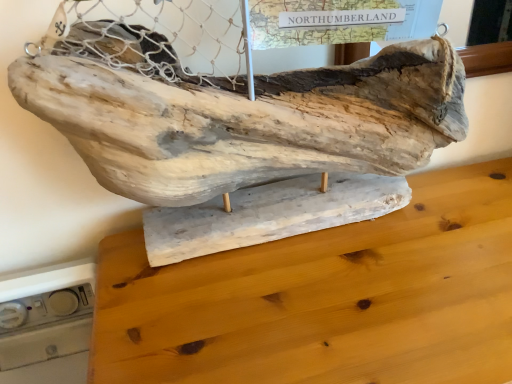
Identify the location of natural wood sculpture at center. (248, 120).

The height and width of the screenshot is (384, 512). What do you see at coordinates (248, 120) in the screenshot?
I see `natural wood sculpture at center` at bounding box center [248, 120].

What do you see at coordinates (325, 298) in the screenshot?
I see `natural wood table at center` at bounding box center [325, 298].

I want to click on natural wood table at center, so click(x=325, y=298).

From the picture: What is the approximate width of natural wood table at center?

16.70 inches.

Identify the location of natural wood sculpture at center. Image resolution: width=512 pixels, height=384 pixels. (248, 120).

Considering the positions of objects natural wood table at center and natural wood sculpture at center in the image provided, who is more to the left, natural wood table at center or natural wood sculpture at center?

Positioned to the left is natural wood sculpture at center.

Who is more distant, natural wood table at center or natural wood sculpture at center?

natural wood sculpture at center.

Between point (270, 350) and point (92, 121), which one is positioned in front?

The point (92, 121) is more forward.

From the image's perspective, is natural wood table at center on natural wood sculpture at center?

No.

From a real-world perspective, is natural wood table at center positioned over natural wood sculpture at center based on gravity?

No, from a real-world perspective, natural wood table at center is not above natural wood sculpture at center.

Between natural wood table at center and natural wood sculpture at center, which one has smaller width?

With smaller width is natural wood sculpture at center.

Is natural wood table at center taller or shorter than natural wood sculpture at center?

In the image, natural wood table at center appears to be taller than natural wood sculpture at center.

Who is bigger, natural wood table at center or natural wood sculpture at center?

natural wood table at center.

From the picture: Is natural wood table at center inside the boundaries of natural wood sculpture at center, or outside?

natural wood table at center is not inside natural wood sculpture at center, it's outside.

Is natural wood table at center touching natural wood sculpture at center?

natural wood table at center is not next to natural wood sculpture at center, and they're not touching.

Is natural wood table at center looking in the opposite direction of natural wood sculpture at center?

That's not correct — natural wood table at center is not looking away from natural wood sculpture at center.

How distant is natural wood table at center from natural wood sculpture at center?

A distance of 6.93 inches exists between natural wood table at center and natural wood sculpture at center.

You are a GUI agent. You are given a task and a screenshot of the screen. Output one action in this format:
    pyautogui.click(x=<x>, y=<y>)
    Task: Click on the furniture below the natural wood sculpture at center (from a real-world perspective)
    Image resolution: width=512 pixels, height=384 pixels.
    Given the screenshot: What is the action you would take?
    pyautogui.click(x=325, y=298)

Considering the relative positions of natural wood sculpture at center and natural wood table at center in the image provided, is natural wood sculpture at center to the left or to the right of natural wood table at center?

Clearly, natural wood sculpture at center is on the left of natural wood table at center in the image.

Considering the positions of objects natural wood sculpture at center and natural wood table at center in the image provided, who is in front, natural wood sculpture at center or natural wood table at center?

Positioned in front is natural wood table at center.

Which is nearer, [258,160] or [419,253]?

Positioned in front is point [258,160].

From the image's perspective, between natural wood sculpture at center and natural wood table at center, which one is located above?

natural wood sculpture at center appears higher in the image.

From a real-world perspective, between natural wood sculpture at center and natural wood table at center, who is vertically higher?

natural wood sculpture at center, from a real-world perspective.

Considering the sizes of natural wood sculpture at center and natural wood table at center in the image, is natural wood sculpture at center wider or thinner than natural wood table at center?

Clearly, natural wood sculpture at center has less width compared to natural wood table at center.

Which of these two, natural wood sculpture at center or natural wood table at center, stands taller?

natural wood table at center is taller.

Which of these two, natural wood sculpture at center or natural wood table at center, is bigger?

natural wood table at center.

Which is correct: natural wood sculpture at center is inside natural wood table at center, or outside of it?

natural wood sculpture at center cannot be found inside natural wood table at center.

Are natural wood sculpture at center and natural wood table at center beside each other?

natural wood sculpture at center is not next to natural wood table at center, and they're not touching.

Is natural wood sculpture at center facing towards natural wood table at center?

No, natural wood sculpture at center does not turn towards natural wood table at center.

Can you tell me how much natural wood sculpture at center and natural wood table at center differ in facing direction?

natural wood sculpture at center and natural wood table at center are facing 2.79 degrees away from each other.

This screenshot has height=384, width=512. I want to click on furniture that appears below the natural wood sculpture at center (from a real-world perspective), so click(325, 298).

Identify the location of furniture that appears on the right of natural wood sculpture at center. This screenshot has height=384, width=512. (325, 298).

Where is `sculpture that is above the natural wood table at center (from a real-world perspective)`? The image size is (512, 384). sculpture that is above the natural wood table at center (from a real-world perspective) is located at coordinates (248, 120).